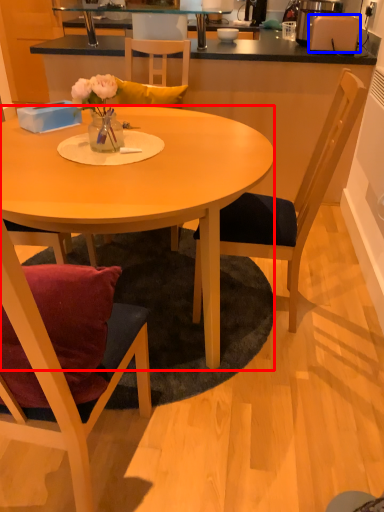
Question: Which object appears closest to the camera in this image, desk (highlighted by a red box) or toaster (highlighted by a blue box)?

Choices:
 (A) desk
 (B) toaster

Answer: (A)